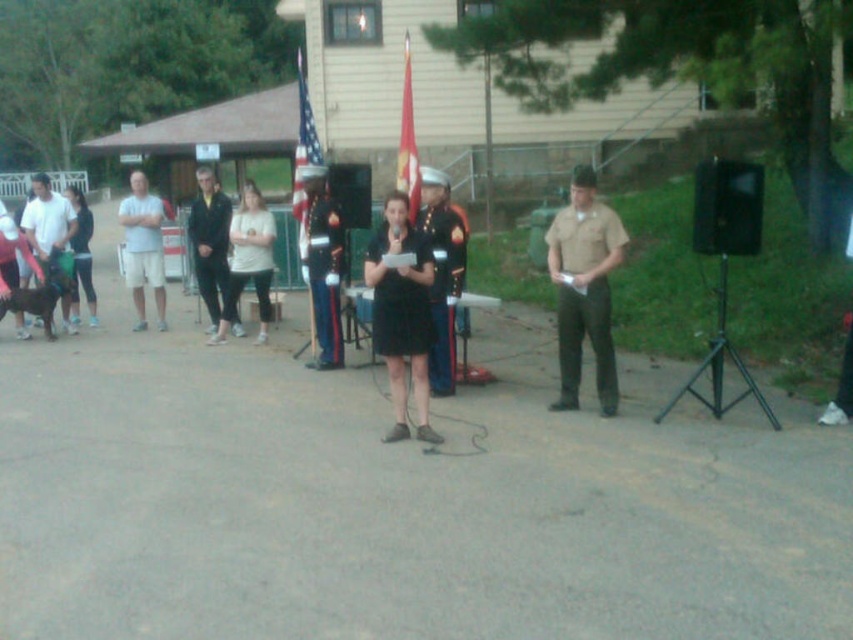
You are organizing a small event and need to place a 20 feet long banner between the american flag at center and the matte black uniform at center. Can the banner fit between them without overlapping either object?

The distance between the american flag at center and the matte black uniform at center is 33.60 feet. Since the banner is only 20 feet long, there will be enough space to place it between them without overlapping either object.

You are organizing an outdoor event and need to place a microphone stand. The microphone stand requires a 1 meter radius space around it to avoid obstruction. Is the black plastic speaker at right positioned within this required space?

The black plastic speaker at right is located at point (727, 208). Without specific spatial dimensions, it is impossible to determine if it falls within the 1 meter radius requirement. Additional measurements are needed.